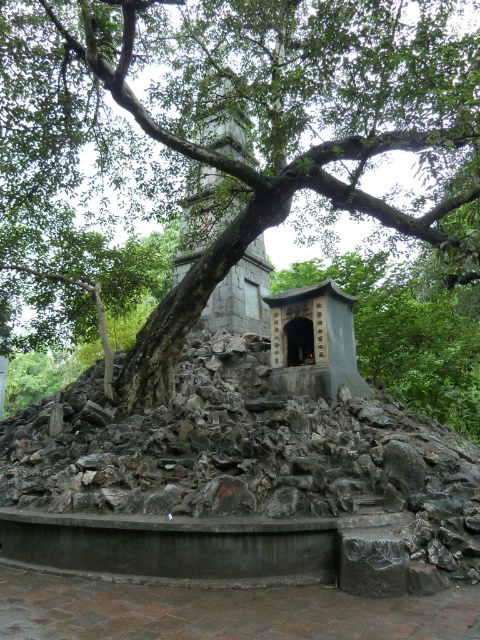
You are standing in front of the shrine and want to take a photo of the gray stone tower at center without the green leafy tree at center blocking it. Which direction should you move to ensure the tower is visible?

Move away from the green leafy tree at center so that the gray stone tower at center comes into view, as the green leafy tree at center is closer to you than the gray stone tower at center.

You are standing in the outdoor scene and want to get a clear view of the shrine. The green leafy tree at center is blocking your view. Can you move to the left or right to see the shrine better?

The green leafy tree at center is located at point (216, 140), so moving to the left or right of the tree might provide a clearer view of the shrine by avoiding the obstruction caused by its branches and leaves.

You are standing in the outdoor scene and want to place a 2.5 meter long bench between the green leafy tree at center and the gray stone tower at center. Will the bench fit between them without overlapping either?

The distance between the green leafy tree at center and the gray stone tower at center is 2.41 meters. Since the bench is 2.5 meters long, it will not fit between them as it is slightly longer than the available space.